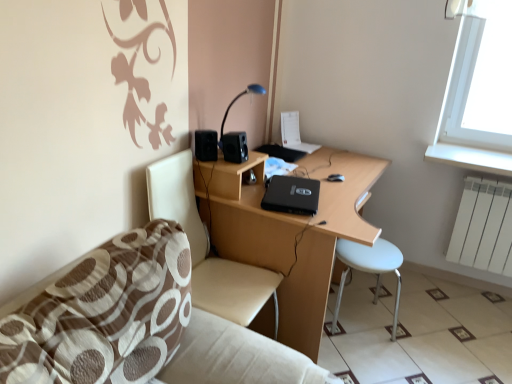
Question: From a real-world perspective, is black matte speaker at upper left, the second speaker positioned from the right, located higher than blue glossy table lamp at upper center?

Choices:
 (A) yes
 (B) no

Answer: (B)

Question: Does black matte speaker at upper left, arranged as the first speaker when viewed from the left, have a greater width compared to blue glossy table lamp at upper center?

Choices:
 (A) no
 (B) yes

Answer: (A)

Question: Does black matte speaker at upper left, the second speaker positioned from the right, lie behind blue glossy table lamp at upper center?

Choices:
 (A) no
 (B) yes

Answer: (A)

Question: From the image's perspective, is black matte speaker at upper left, the second speaker positioned from the right, over blue glossy table lamp at upper center?

Choices:
 (A) yes
 (B) no

Answer: (B)

Question: Is black matte speaker at upper left, the second speaker positioned from the right, not inside blue glossy table lamp at upper center?

Choices:
 (A) no
 (B) yes

Answer: (B)

Question: Can you confirm if black matte speaker at upper left, arranged as the first speaker when viewed from the left, is bigger than blue glossy table lamp at upper center?

Choices:
 (A) yes
 (B) no

Answer: (B)

Question: Can you confirm if white glossy tile at lower right is positioned to the right of white plastic stool at lower right?

Choices:
 (A) no
 (B) yes

Answer: (B)

Question: Is white glossy tile at lower right to the left of white plastic stool at lower right from the viewer's perspective?

Choices:
 (A) no
 (B) yes

Answer: (A)

Question: Is white glossy tile at lower right thinner than white plastic stool at lower right?

Choices:
 (A) yes
 (B) no

Answer: (B)

Question: From the image's perspective, does white glossy tile at lower right appear lower than white plastic stool at lower right?

Choices:
 (A) no
 (B) yes

Answer: (B)

Question: Is white glossy tile at lower right smaller than white plastic stool at lower right?

Choices:
 (A) no
 (B) yes

Answer: (A)

Question: Is white glossy tile at lower right bigger than white plastic stool at lower right?

Choices:
 (A) no
 (B) yes

Answer: (B)

Question: Is white glossy tile at lower right wider than blue glossy table lamp at upper center?

Choices:
 (A) yes
 (B) no

Answer: (A)